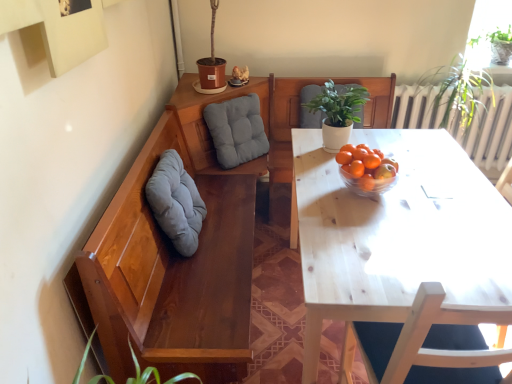
In order to face light wood table at center, should I rotate leftwards or rightwards?

A 22.559 degree turn to the right will do.

What do you see at coordinates (489, 17) in the screenshot?
I see `transparent glass window at upper right` at bounding box center [489, 17].

The image size is (512, 384). Describe the element at coordinates (338, 112) in the screenshot. I see `green matte plant at upper center` at that location.

You are a GUI agent. You are given a task and a screenshot of the screen. Output one action in this format:
    pyautogui.click(x=<x>, y=<y>)
    Task: Click on the light wood table at center
    The height and width of the screenshot is (384, 512).
    Given the screenshot: What is the action you would take?
    pyautogui.click(x=399, y=236)

Does point (390, 265) come closer to viewer compared to point (164, 216)?

Yes, point (390, 265) is in front of point (164, 216).

Which of these two, light wood table at center or soft gray cushion at left, the second gray when ordered from back to front, is thinner?

Thinner between the two is soft gray cushion at left, the second gray when ordered from back to front.

Is light wood table at center spatially inside soft gray cushion at left, the second gray when ordered from back to front, or outside of it?

light wood table at center is spatially situated outside soft gray cushion at left, the second gray when ordered from back to front.

Are soft gray cushion at left, the second gray when ordered from back to front, and light wood table at center far apart?

No, soft gray cushion at left, the second gray when ordered from back to front, is in close proximity to light wood table at center.

Is soft gray cushion at left, the second gray when ordered from back to front, oriented away from light wood table at center?

No, light wood table at center is not at the back of soft gray cushion at left, the second gray when ordered from back to front.

Is light wood table at center completely or partially inside soft gray cushion at left, the first gray from the front?

No, soft gray cushion at left, the first gray from the front, does not contain light wood table at center.

Which of these two, soft gray cushion at left, the second gray when ordered from back to front, or light wood table at center, is wider?

Wider between the two is light wood table at center.

Is matte gray cushion at center, which is counted as the 1th gray, starting from the back, positioned with its back to transparent glass window at upper right?

No, transparent glass window at upper right is not at the back of matte gray cushion at center, which is counted as the 1th gray, starting from the back.

Does matte gray cushion at center, the 2th gray positioned from the front, come behind transparent glass window at upper right?

No, it is not.

Based on the photo, which of these two, matte gray cushion at center, which is counted as the 1th gray, starting from the back, or transparent glass window at upper right, is smaller?

transparent glass window at upper right.

From the image's perspective, is green matte plant at upper center on matte gray cushion at center, the 2th gray positioned from the front?

Yes, from the image's perspective, green matte plant at upper center is on top of matte gray cushion at center, the 2th gray positioned from the front.

Which gray is the 1st one when counting from the front of the green matte plant at upper center? Please provide its 2D coordinates.

[(236, 130)]

Is green matte plant at upper center to the right of matte gray cushion at center, the 2th gray positioned from the front, from the viewer's perspective?

Yes, green matte plant at upper center is to the right of matte gray cushion at center, the 2th gray positioned from the front.

Is transparent glass window at upper right thinner than green matte plant at upper center?

No, transparent glass window at upper right is not thinner than green matte plant at upper center.

In the scene shown: Is transparent glass window at upper right inside the boundaries of green matte plant at upper center, or outside?

transparent glass window at upper right lies outside green matte plant at upper center.

Is the depth of transparent glass window at upper right less than that of green matte plant at upper center?

No.

From the image's perspective, who appears lower, green matte plant at upper center or soft gray cushion at left, the second gray when ordered from back to front?

soft gray cushion at left, the second gray when ordered from back to front, is shown below in the image.

Between point (326, 124) and point (181, 229), which one is positioned behind?

The point (326, 124) is behind.

Looking at this image, can you tell me how much green matte plant at upper center and soft gray cushion at left, the first gray from the front, differ in facing direction?

The angle between the facing direction of green matte plant at upper center and the facing direction of soft gray cushion at left, the first gray from the front, is 88.7 degrees.

Considering the sizes of objects green matte plant at upper center and soft gray cushion at left, the second gray when ordered from back to front, in the image provided, who is shorter, green matte plant at upper center or soft gray cushion at left, the second gray when ordered from back to front,?

Standing shorter between the two is green matte plant at upper center.

Could you tell me if soft gray cushion at left, the second gray when ordered from back to front, is turned towards green matte plant at upper center?

No, soft gray cushion at left, the second gray when ordered from back to front, is not oriented towards green matte plant at upper center.

Does soft gray cushion at left, the first gray from the front, have a greater height compared to green matte plant at upper center?

Yes.

From a real-world perspective, does soft gray cushion at left, the second gray when ordered from back to front, stand above green matte plant at upper center?

Incorrect, from a real-world perspective, soft gray cushion at left, the second gray when ordered from back to front, is lower than green matte plant at upper center.

Locate an element on the screen. table below the soft gray cushion at left, the first gray from the front (from a real-world perspective) is located at coordinates (399, 236).

Which gray is the 2nd one when counting from the left side of the light wood table at center? Please provide its 2D coordinates.

[(176, 202)]

Considering their positions, is transparent glass window at upper right positioned further to matte gray cushion at center, the 2th gray positioned from the front, than soft gray cushion at left, the first gray from the front?

Among the two, transparent glass window at upper right is located further to matte gray cushion at center, the 2th gray positioned from the front.

Considering their positions, is light wood table at center positioned closer to matte gray cushion at center, the 2th gray positioned from the front, than green matte plant at upper center?

green matte plant at upper center is positioned closer to the anchor matte gray cushion at center, the 2th gray positioned from the front.

Considering their positions, is soft gray cushion at left, the second gray when ordered from back to front, positioned closer to transparent glass window at upper right than matte gray cushion at center, which is counted as the 1th gray, starting from the back?

matte gray cushion at center, which is counted as the 1th gray, starting from the back, lies closer to transparent glass window at upper right than the other object.

Which object lies nearer to the anchor point light wood table at center, green matte plant at upper center or soft gray cushion at left, the first gray from the front?

green matte plant at upper center.

Considering their positions, is matte gray cushion at center, which is counted as the 1th gray, starting from the back, positioned closer to soft gray cushion at left, the second gray when ordered from back to front, than transparent glass window at upper right?

matte gray cushion at center, which is counted as the 1th gray, starting from the back, is positioned closer to the anchor soft gray cushion at left, the second gray when ordered from back to front.

From the image, which object appears to be farther from green matte plant at upper center, transparent glass window at upper right or soft gray cushion at left, the second gray when ordered from back to front?

Based on the image, transparent glass window at upper right appears to be further to green matte plant at upper center.

When comparing their distances from green matte plant at upper center, does light wood table at center or transparent glass window at upper right seem further?

Among the two, transparent glass window at upper right is located further to green matte plant at upper center.

Which object lies nearer to the anchor point light wood table at center, soft gray cushion at left, the first gray from the front, or green matte plant at upper center?

green matte plant at upper center lies closer to light wood table at center than the other object.

Locate an element on the screen. gray between soft gray cushion at left, the second gray when ordered from back to front, and green matte plant at upper center in the front-back direction is located at coordinates (236, 130).

Locate an element on the screen. gray between soft gray cushion at left, the first gray from the front, and transparent glass window at upper right, in the horizontal direction is located at coordinates (236, 130).

This screenshot has width=512, height=384. In order to click on houseplant between soft gray cushion at left, the second gray when ordered from back to front, and transparent glass window at upper right in this screenshot , I will do `click(338, 112)`.

Image resolution: width=512 pixels, height=384 pixels. I want to click on gray between light wood table at center and matte gray cushion at center, which is counted as the 1th gray, starting from the back, in the front-back direction, so click(x=176, y=202).